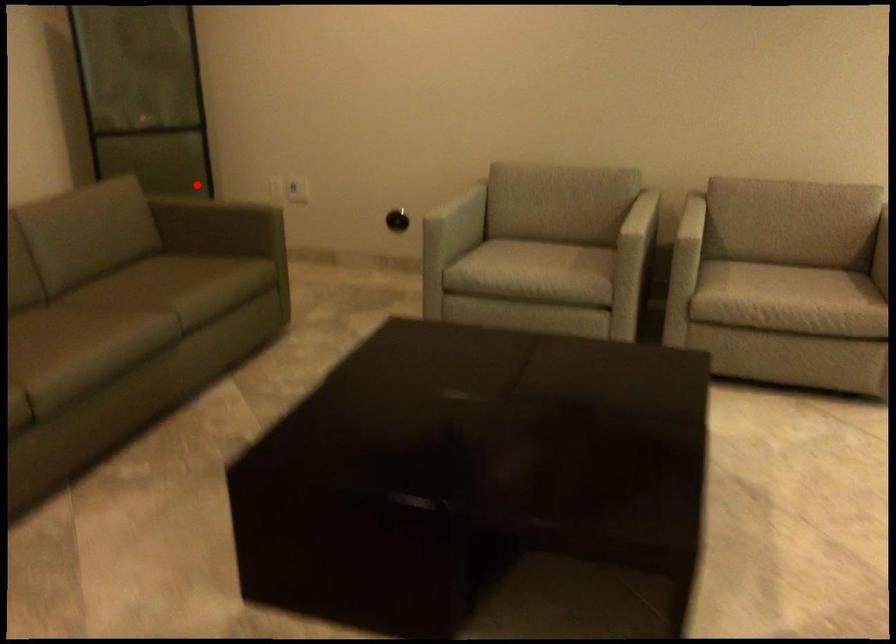
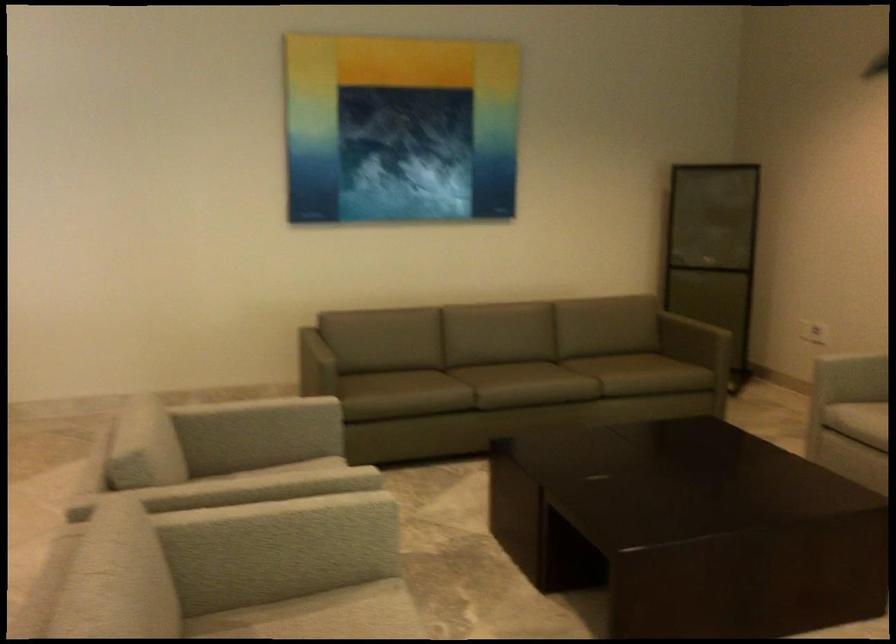
Question: A red point is marked in image1. In image2, is the corresponding 3D point closer to the camera or farther? Reply with the corresponding letter.

Choices:
 (A) The corresponding 3D point is closer.
 (B) The corresponding 3D point is farther.

Answer: (B)